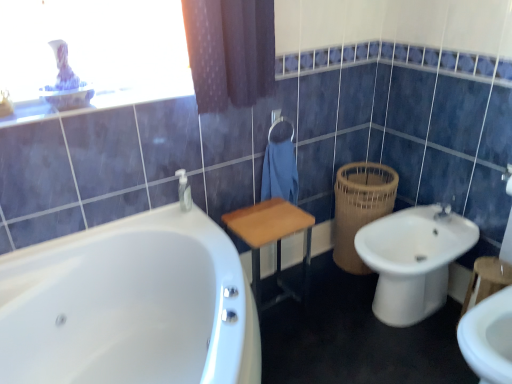
Locate an element on the screen. This screenshot has height=384, width=512. free location in front of wooden table at center is located at coordinates (295, 349).